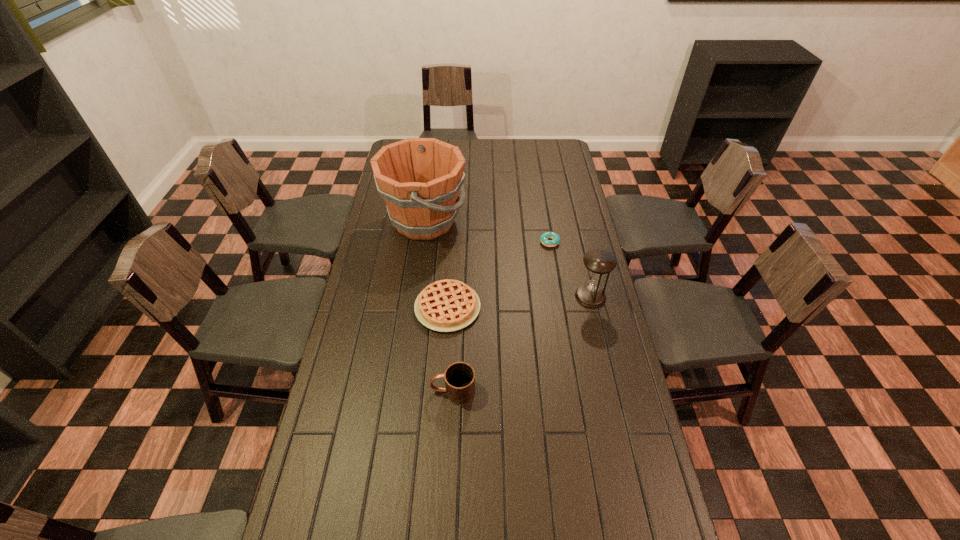
Locate an element on the screen. object that is the second closest to the nearest object is located at coordinates (598, 262).

Locate an element on the screen. the third closest object to the pie is located at coordinates (545, 236).

The height and width of the screenshot is (540, 960). Identify the location of free spot that satisfies the following two spatial constraints: 1. on the back side of the pie; 2. on the left side of the rightmost object. (448, 296).

Locate an element on the screen. blank space that satisfies the following two spatial constraints: 1. on the handle side of the bucket; 2. on the right side of the fourth tallest object is located at coordinates (413, 307).

Where is `vacant point that satisfies the following two spatial constraints: 1. on the back side of the doughnut; 2. on the handle side of the bucket`? vacant point that satisfies the following two spatial constraints: 1. on the back side of the doughnut; 2. on the handle side of the bucket is located at coordinates (546, 221).

You are a GUI agent. You are given a task and a screenshot of the screen. Output one action in this format:
    pyautogui.click(x=<x>, y=<y>)
    Task: Click on the free space that satisfies the following two spatial constraints: 1. on the handle side of the bucket; 2. on the left side of the pie
    The width and height of the screenshot is (960, 540).
    Given the screenshot: What is the action you would take?
    pyautogui.click(x=413, y=307)